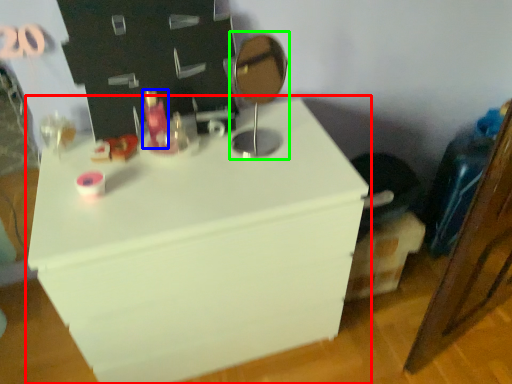
Question: Estimate the real-world distances between objects in this image. Which object is closer to furniture (highlighted by a red box), toiletry (highlighted by a blue box) or table lamp (highlighted by a green box)?

Choices:
 (A) toiletry
 (B) table lamp

Answer: (B)